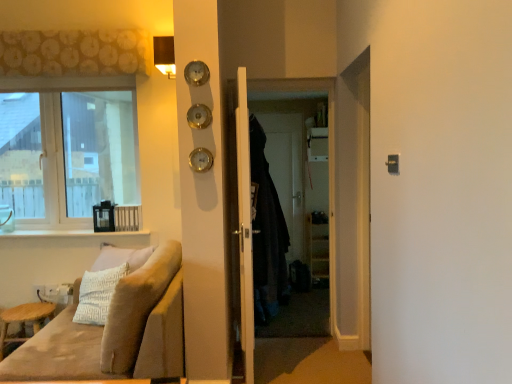
Find the location of a particular element. dark fabric coat at center is located at coordinates click(x=267, y=233).

You are a GUI agent. You are given a task and a screenshot of the screen. Output one action in this format:
    pyautogui.click(x=<x>, y=<y>)
    Task: Click on the clear glass window at upper left
    
    Given the screenshot: What is the action you would take?
    pyautogui.click(x=67, y=149)

What do you see at coordinates (245, 227) in the screenshot?
I see `white wooden door at center` at bounding box center [245, 227].

In order to face gold metallic clock at center, should I rotate leftwards or rightwards?

Turn left by 7.486 degrees to look at gold metallic clock at center.

Identify the location of dark fabric coat at center. (267, 233).

From a real-world perspective, is clear glass window at upper left located beneath dark fabric screen door at center?

Incorrect, from a real-world perspective, clear glass window at upper left is higher than dark fabric screen door at center.

Between clear glass window at upper left and dark fabric screen door at center, which one has larger size?

clear glass window at upper left.

Is point (80, 219) closer or farther from the camera than point (331, 234)?

Point (80, 219) is farther from the camera than point (331, 234).

Who is shorter, clear glass window at upper left or dark fabric screen door at center?

With less height is clear glass window at upper left.

Considering the sizes of light brown wooden stool at lower left and gold metallic clock at center in the image, is light brown wooden stool at lower left taller or shorter than gold metallic clock at center?

In the image, light brown wooden stool at lower left appears to be taller than gold metallic clock at center.

Considering the positions of point (9, 338) and point (193, 157), is point (9, 338) closer or farther from the camera than point (193, 157)?

Point (9, 338) appears to be farther away from the viewer than point (193, 157).

Which of these two, light brown wooden stool at lower left or gold metallic clock at center, is bigger?

light brown wooden stool at lower left.

Locate an element on the screen. Image resolution: width=512 pixels, height=384 pixels. clock above the white wooden door at center (from a real-world perspective) is located at coordinates (201, 160).

Which is more to the left, gold metallic clock at center or white wooden door at center?

gold metallic clock at center.

Is white wooden door at center at the back of gold metallic clock at center?

gold metallic clock at center does not have its back to white wooden door at center.

Is the position of gold metallic clock at center less distant than that of white wooden door at center?

Yes, the depth of gold metallic clock at center is less than that of white wooden door at center.

Where is `furniture to the left of patterned fabric curtain at upper left`? This screenshot has width=512, height=384. furniture to the left of patterned fabric curtain at upper left is located at coordinates (24, 319).

Could you tell me if light brown wooden stool at lower left is facing patterned fabric curtain at upper left?

No, light brown wooden stool at lower left is not aimed at patterned fabric curtain at upper left.

From the image's perspective, does light brown wooden stool at lower left appear lower than patterned fabric curtain at upper left?

Yes.

Is light brown wooden stool at lower left positioned beyond the bounds of patterned fabric curtain at upper left?

Indeed, light brown wooden stool at lower left is completely outside patterned fabric curtain at upper left.

From a real-world perspective, is white wooden door at center physically located above or below velvet beige couch at lower left?

white wooden door at center is above velvet beige couch at lower left.

Identify the location of door to the right of velvet beige couch at lower left. (245, 227).

Is the depth of white wooden door at center greater than that of velvet beige couch at lower left?

Yes, white wooden door at center is further from the camera.

How different are the orientations of white wooden door at center and velvet beige couch at lower left in degrees?

They differ by 172 degrees in their facing directions.

Is point (55, 232) positioned in front of point (64, 50)?

No, it is behind (64, 50).

This screenshot has height=384, width=512. Find the location of `curtain located above the white glossy window sill at lower left (from the image's perspective)`. curtain located above the white glossy window sill at lower left (from the image's perspective) is located at coordinates (74, 52).

Considering the sizes of white glossy window sill at lower left and patterned fabric curtain at upper left in the image, is white glossy window sill at lower left taller or shorter than patterned fabric curtain at upper left?

white glossy window sill at lower left is shorter than patterned fabric curtain at upper left.

Is white glossy window sill at lower left next to patterned fabric curtain at upper left and touching it?

No, white glossy window sill at lower left is not with patterned fabric curtain at upper left.

Which point is more distant from viewer, (206, 155) or (329, 210)?

The point (329, 210) is more distant.

Is gold metallic clock at center at the left side of dark fabric screen door at center?

Yes, gold metallic clock at center is to the left of dark fabric screen door at center.

I want to click on screen door located underneath the gold metallic clock at center (from a real-world perspective), so click(328, 158).

The image size is (512, 384). I want to click on window above the dark fabric screen door at center (from the image's perspective), so click(x=67, y=149).

Where is `clock on the right side of light brown wooden stool at lower left`? The image size is (512, 384). clock on the right side of light brown wooden stool at lower left is located at coordinates (201, 160).

Looking at the image, which one is located closer to dark fabric screen door at center, clear glass window at upper left or light brown wooden stool at lower left?

clear glass window at upper left is closer to dark fabric screen door at center.

From the picture: Looking at the image, which one is located closer to dark fabric coat at center, gold metallic clock at center or dark fabric screen door at center?

The object closer to dark fabric coat at center is gold metallic clock at center.

Looking at the image, which one is located closer to gold metallic clock at center, white glossy window sill at lower left or dark fabric screen door at center?

The object closer to gold metallic clock at center is dark fabric screen door at center.

Looking at this image, considering their positions, is velvet beige couch at lower left positioned further to gold metallic clock at center than patterned fabric curtain at upper left?

patterned fabric curtain at upper left.

When comparing their distances from white glossy window sill at lower left, does velvet beige couch at lower left or gold metallic clock at center seem further?

gold metallic clock at center lies further to white glossy window sill at lower left than the other object.

Consider the image. Based on their spatial positions, is patterned fabric curtain at upper left or white wooden door at center further from dark fabric screen door at center?

patterned fabric curtain at upper left is positioned further to the anchor dark fabric screen door at center.

Which object lies nearer to the anchor point gold metallic clock at center, patterned fabric curtain at upper left or light brown wooden stool at lower left?

patterned fabric curtain at upper left.

Estimate the real-world distances between objects in this image. Which object is closer to dark fabric coat at center, patterned fabric curtain at upper left or light brown wooden stool at lower left?

The object closer to dark fabric coat at center is patterned fabric curtain at upper left.

Locate an element on the screen. window sill between velvet beige couch at lower left and clear glass window at upper left from front to back is located at coordinates (69, 233).

Find the location of a particular element. This screenshot has height=384, width=512. door situated between patterned fabric curtain at upper left and dark fabric screen door at center from left to right is located at coordinates (245, 227).

Where is `door between gold metallic clock at center and dark fabric coat at center in the horizontal direction`? This screenshot has height=384, width=512. door between gold metallic clock at center and dark fabric coat at center in the horizontal direction is located at coordinates (245, 227).

Locate an element on the screen. The width and height of the screenshot is (512, 384). studio couch located between white glossy window sill at lower left and dark fabric screen door at center in the left-right direction is located at coordinates (114, 330).